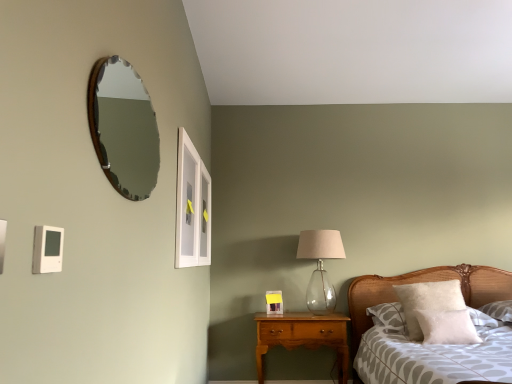
Question: From the image's perspective, is wooden-framed mirror at upper left under clear glass window at upper center?

Choices:
 (A) yes
 (B) no

Answer: (B)

Question: Does wooden-framed mirror at upper left have a lesser width compared to clear glass window at upper center?

Choices:
 (A) yes
 (B) no

Answer: (B)

Question: Is wooden-framed mirror at upper left facing towards clear glass window at upper center?

Choices:
 (A) no
 (B) yes

Answer: (A)

Question: Can you confirm if wooden-framed mirror at upper left is taller than clear glass window at upper center?

Choices:
 (A) yes
 (B) no

Answer: (B)

Question: Does wooden-framed mirror at upper left have a lesser height compared to clear glass window at upper center?

Choices:
 (A) no
 (B) yes

Answer: (B)

Question: From their relative heights in the image, would you say wooden-framed mirror at upper left is taller or shorter than white fluffy pillow at right, which is the 2th pillow from back to front?

Choices:
 (A) short
 (B) tall

Answer: (B)

Question: Would you say wooden-framed mirror at upper left is inside or outside white fluffy pillow at right, which appears as the 1th pillow when viewed from the front?

Choices:
 (A) outside
 (B) inside

Answer: (A)

Question: Would you say wooden-framed mirror at upper left is to the left or to the right of white fluffy pillow at right, which appears as the 1th pillow when viewed from the front, in the picture?

Choices:
 (A) left
 (B) right

Answer: (A)

Question: Considering the positions of wooden-framed mirror at upper left and white fluffy pillow at right, which appears as the 1th pillow when viewed from the front, in the image, is wooden-framed mirror at upper left wider or thinner than white fluffy pillow at right, which appears as the 1th pillow when viewed from the front,?

Choices:
 (A) wide
 (B) thin

Answer: (B)

Question: Is matte white picture frame at center in front of or behind translucent glass table lamp at center-right in the image?

Choices:
 (A) front
 (B) behind

Answer: (B)

Question: Is matte white picture frame at center inside the boundaries of translucent glass table lamp at center-right, or outside?

Choices:
 (A) outside
 (B) inside

Answer: (A)

Question: From the image's perspective, is matte white picture frame at center positioned above or below translucent glass table lamp at center-right?

Choices:
 (A) below
 (B) above

Answer: (A)

Question: Looking at their shapes, would you say matte white picture frame at center is wider or thinner than translucent glass table lamp at center-right?

Choices:
 (A) thin
 (B) wide

Answer: (A)

Question: Considering the positions of white fluffy pillow at right, placed as the first pillow when sorted from back to front, and matte white picture frame at center in the image, is white fluffy pillow at right, placed as the first pillow when sorted from back to front, bigger or smaller than matte white picture frame at center?

Choices:
 (A) small
 (B) big

Answer: (B)

Question: From the image's perspective, relative to matte white picture frame at center, is white fluffy pillow at right, marked as the 2th pillow in a front-to-back arrangement, above or below?

Choices:
 (A) above
 (B) below

Answer: (A)